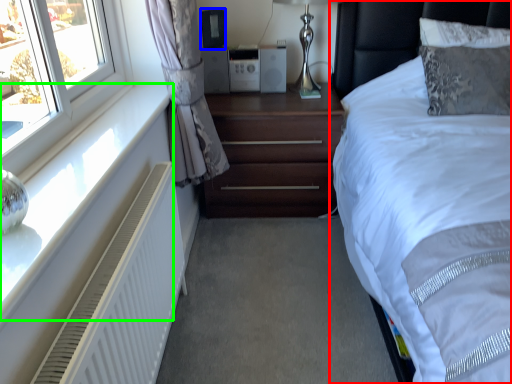
Question: Considering the real-world distances, which object is closest to bed (highlighted by a red box)? speaker (highlighted by a blue box) or window sill (highlighted by a green box).

Choices:
 (A) speaker
 (B) window sill

Answer: (A)